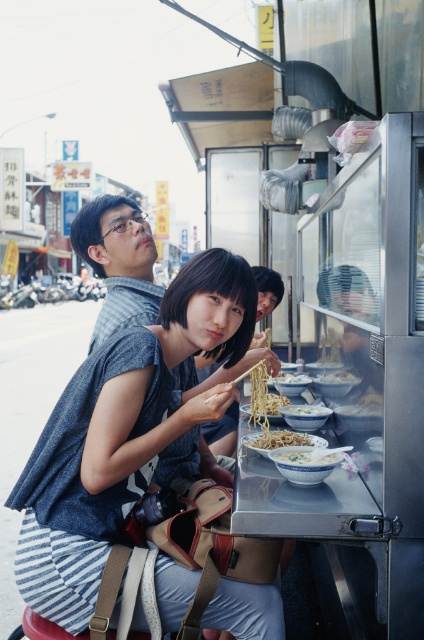
You are a delivery person who needs to place a small package on the white matte bowl at center without touching the matte blue shirt at upper left. Can you do this if the package requires a minimum of 20 inches of space?

The matte blue shirt at upper left is 35.49 inches away from the white matte bowl at center. Since the required space is 20 inches, the delivery person can safely place the package on the white matte bowl at center without touching the matte blue shirt at upper left.

You are standing in front of the food stall and want to locate the matte blue shirt at upper left. What are the coordinates where you can find it?

The matte blue shirt at upper left is located at coordinates point (119, 262).